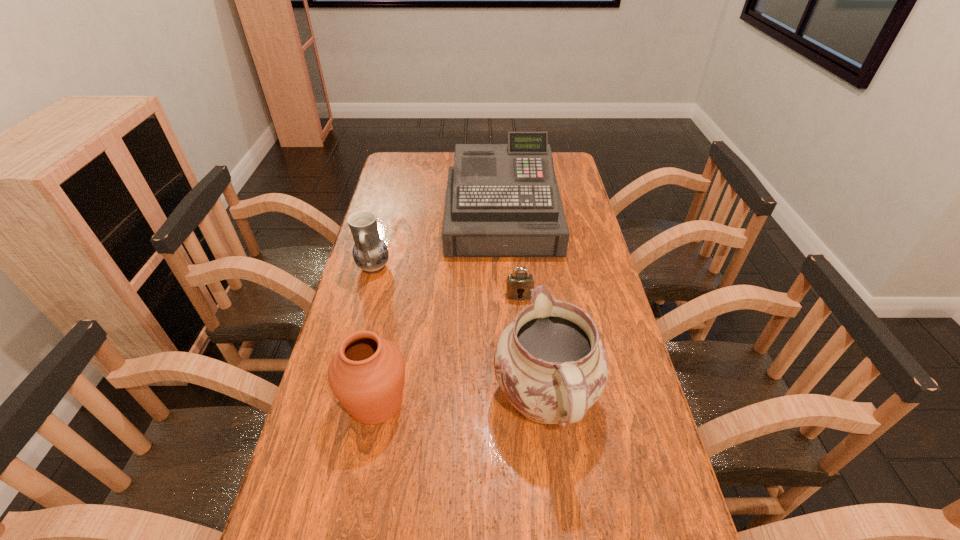
Locate an element on the screen. free space located 0.130m on the front of the urn is located at coordinates (358, 492).

In order to click on vacant space situated 0.240m on the back of the pottery in this screenshot , I will do `click(388, 212)`.

You are a GUI agent. You are given a task and a screenshot of the screen. Output one action in this format:
    pyautogui.click(x=<x>, y=<y>)
    Task: Click on the free spot located 0.190m at the front of the shortest object near the keyhole
    This screenshot has height=540, width=960.
    Given the screenshot: What is the action you would take?
    pyautogui.click(x=524, y=351)

The height and width of the screenshot is (540, 960). What are the coordinates of `urn located at the left edge` in the screenshot? It's located at (367, 373).

Where is `pottery positioned at the left edge`? The image size is (960, 540). pottery positioned at the left edge is located at coordinates (370, 253).

You are a GUI agent. You are given a task and a screenshot of the screen. Output one action in this format:
    pyautogui.click(x=<x>, y=<y>)
    Task: Click on the cash register at the right edge
    This screenshot has height=540, width=960.
    Given the screenshot: What is the action you would take?
    pyautogui.click(x=502, y=200)

Where is `pitcher at the right edge`? This screenshot has width=960, height=540. pitcher at the right edge is located at coordinates (550, 363).

The height and width of the screenshot is (540, 960). In order to click on vacant space at the left edge of the desktop in this screenshot , I will do `click(416, 181)`.

Find the location of `free region at the right edge of the desktop`. free region at the right edge of the desktop is located at coordinates (605, 291).

Identify the location of free location at the far right corner. (568, 172).